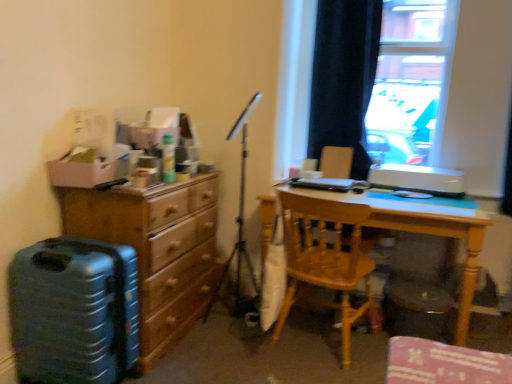
Where is `teal plastic suitcase at left`? This screenshot has width=512, height=384. teal plastic suitcase at left is located at coordinates (74, 311).

Locate an element on the screen. The image size is (512, 384). wooden chair at center is located at coordinates (326, 260).

What do you see at coordinates (408, 229) in the screenshot? This screenshot has height=384, width=512. I see `light wood desk at center` at bounding box center [408, 229].

In order to face transparent glass window at upper right, should I rotate leftwards or rightwards?

You should rotate right by 14.752 degrees.

You are a GUI agent. You are given a task and a screenshot of the screen. Output one action in this format:
    pyautogui.click(x=<x>, y=<y>)
    Task: Click on the teal plastic suitcase at left
    This screenshot has height=384, width=512.
    Given the screenshot: What is the action you would take?
    pyautogui.click(x=74, y=311)

Who is smaller, transparent glass window at upper right or wooden chair at center?

transparent glass window at upper right is smaller.

Between transparent glass window at upper right and wooden chair at center, which one appears on the right side from the viewer's perspective?

transparent glass window at upper right is more to the right.

Is transparent glass window at upper right taller than wooden chair at center?

Yes, transparent glass window at upper right is taller than wooden chair at center.

Between transparent glass window at upper right and wooden chair at center, which one is positioned behind?

transparent glass window at upper right is more distant.

Can you confirm if transparent glass window at upper right is bigger than metallic tripod at center?

Yes, transparent glass window at upper right is bigger than metallic tripod at center.

How different are the orientations of transparent glass window at upper right and metallic tripod at center in degrees?

The angular difference between transparent glass window at upper right and metallic tripod at center is 95.2 degrees.

Would you say transparent glass window at upper right is outside metallic tripod at center?

Absolutely, transparent glass window at upper right is external to metallic tripod at center.

Is transparent glass window at upper right facing towards metallic tripod at center?

Yes, transparent glass window at upper right is turned towards metallic tripod at center.

Is dark velvet curtain at upper right at the left side of light wood desk at center?

Correct, you'll find dark velvet curtain at upper right to the left of light wood desk at center.

Considering the sizes of dark velvet curtain at upper right and light wood desk at center in the image, is dark velvet curtain at upper right bigger or smaller than light wood desk at center?

In the image, dark velvet curtain at upper right appears to be smaller than light wood desk at center.

Which object is further away from the camera taking this photo, dark velvet curtain at upper right or light wood desk at center?

dark velvet curtain at upper right is further from the camera.

Between dark velvet curtain at upper right and light wood desk at center, which one has smaller width?

dark velvet curtain at upper right is thinner.

Is metallic tripod at center placed right next to wooden chest of drawers at left?

No, metallic tripod at center is not beside wooden chest of drawers at left.

Is metallic tripod at center shorter than wooden chest of drawers at left?

No.

How much distance is there between metallic tripod at center and wooden chest of drawers at left?

metallic tripod at center is 20.79 inches from wooden chest of drawers at left.

From a real-world perspective, does metallic tripod at center stand above wooden chest of drawers at left?

Yes, from a real-world perspective, metallic tripod at center is above wooden chest of drawers at left.

Is light wood desk at center to the left or to the right of transparent glass window at upper right in the image?

light wood desk at center is to the left of transparent glass window at upper right.

Which object is thinner, light wood desk at center or transparent glass window at upper right?

transparent glass window at upper right.

Is point (449, 218) farther from viewer compared to point (391, 117)?

No, (449, 218) is in front of (391, 117).

From a real-world perspective, who is located higher, transparent glass window at upper right or wooden chest of drawers at left?

transparent glass window at upper right, from a real-world perspective.

From the image's perspective, which object appears higher, transparent glass window at upper right or wooden chest of drawers at left?

transparent glass window at upper right.

The height and width of the screenshot is (384, 512). In the image, there is a transparent glass window at upper right. Identify the location of the chest of drawers below it (from the image's perspective). (156, 249).

Considering the positions of point (387, 60) and point (175, 206), is point (387, 60) closer or farther from the camera than point (175, 206)?

Point (387, 60) is positioned farther from the camera compared to point (175, 206).

Is wooden chair at center facing away from wooden chest of drawers at left?

wooden chair at center is not turned away from wooden chest of drawers at left.

Between wooden chair at center and wooden chest of drawers at left, which one has smaller width?

wooden chest of drawers at left is thinner.

Measure the distance from wooden chair at center to wooden chest of drawers at left.

The distance of wooden chair at center from wooden chest of drawers at left is 26.44 inches.

How many degrees apart are the facing directions of wooden chair at center and wooden chest of drawers at left?

78.8 degrees separate the facing orientations of wooden chair at center and wooden chest of drawers at left.

At what (x,y) coordinates should I click in order to perform the action: click on chair below the transparent glass window at upper right (from the image's perspective). Please return your answer as a coordinate pair (x, y). The width and height of the screenshot is (512, 384). Looking at the image, I should click on (326, 260).

At what (x,y) coordinates should I click in order to perform the action: click on tripod that appears in front of the transparent glass window at upper right. Please return your answer as a coordinate pair (x, y). The image size is (512, 384). Looking at the image, I should click on (237, 234).

When comparing their distances from wooden chair at center, does light wood desk at center or transparent glass window at upper right seem further?

Among the two, transparent glass window at upper right is located further to wooden chair at center.

When comparing their distances from wooden chair at center, does transparent glass window at upper right or dark velvet curtain at upper right seem further?

The object further to wooden chair at center is transparent glass window at upper right.

When comparing their distances from dark velvet curtain at upper right, does wooden chest of drawers at left or metallic tripod at center seem further?

The object further to dark velvet curtain at upper right is wooden chest of drawers at left.

Based on their spatial positions, is metallic tripod at center or dark velvet curtain at upper right closer to light wood desk at center?

Based on the image, dark velvet curtain at upper right appears to be nearer to light wood desk at center.

Considering their positions, is wooden chair at center positioned closer to dark velvet curtain at upper right than light wood desk at center?

The object closer to dark velvet curtain at upper right is light wood desk at center.

Based on their spatial positions, is transparent glass window at upper right or teal plastic suitcase at left further from light wood desk at center?

teal plastic suitcase at left is positioned further to the anchor light wood desk at center.

From the image, which object appears to be farther from wooden chair at center, light wood desk at center or metallic tripod at center?

metallic tripod at center lies further to wooden chair at center than the other object.

When comparing their distances from transparent glass window at upper right, does light wood desk at center or teal plastic suitcase at left seem further?

The object further to transparent glass window at upper right is teal plastic suitcase at left.

What are the coordinates of `chair situated between metallic tripod at center and light wood desk at center from left to right` in the screenshot? It's located at (326, 260).

Identify the location of tripod between wooden chest of drawers at left and light wood desk at center in the horizontal direction. (237, 234).

Where is `tripod between transparent glass window at upper right and light wood desk at center in the up-down direction`? The image size is (512, 384). tripod between transparent glass window at upper right and light wood desk at center in the up-down direction is located at coordinates (237, 234).

In order to click on curtain between teal plastic suitcase at left and transparent glass window at upper right in this screenshot , I will do `click(344, 77)`.